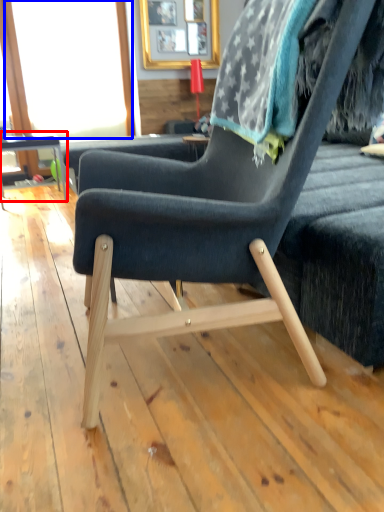
Question: Which object is closer to the camera taking this photo, table (highlighted by a red box) or window screen (highlighted by a blue box)?

Choices:
 (A) table
 (B) window screen

Answer: (A)